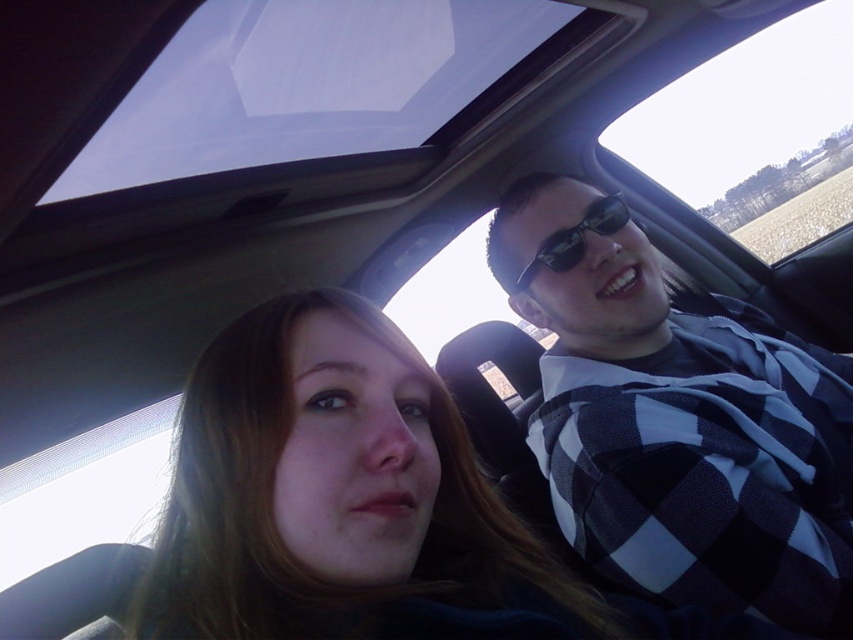
You are a photographer trying to capture the perfect shot of the black checkered shirt at right inside the car. Given the coordinates provided, where exactly should you position your camera to ensure the shirt is centered in the frame?

To center the black checkered shirt at right in the frame, position the camera so that the shirt aligns with the center coordinates of the image, which is typically at point [426,320]. Since the shirt is at [677,419], adjust the camera to move the shirt from its current position to the center by moving the camera left and down accordingly.

You are a photographer taking a picture of the car interior. You notice the smooth brown hair at center and the black plastic sunglasses at upper right. Which object is positioned lower in the image?

The smooth brown hair at center is located below the black plastic sunglasses at upper right, so the smooth brown hair at center is positioned lower in the image.

You are a photographer trying to capture the person with smooth brown hair at center in the car. The car has a sunroof open at point (277, 515). To ensure the best lighting, you need to position your camera so that the sunlight coming through the sunroof directly illuminates their hair. Based on the coordinates provided, is the smooth brown hair at center positioned directly under the open sunroof?

The smooth brown hair at center is located at point (277, 515), which is the same as the coordinates of the open sunroof. Therefore, the smooth brown hair at center is positioned directly under the open sunroof, allowing sunlight to illuminate it effectively.